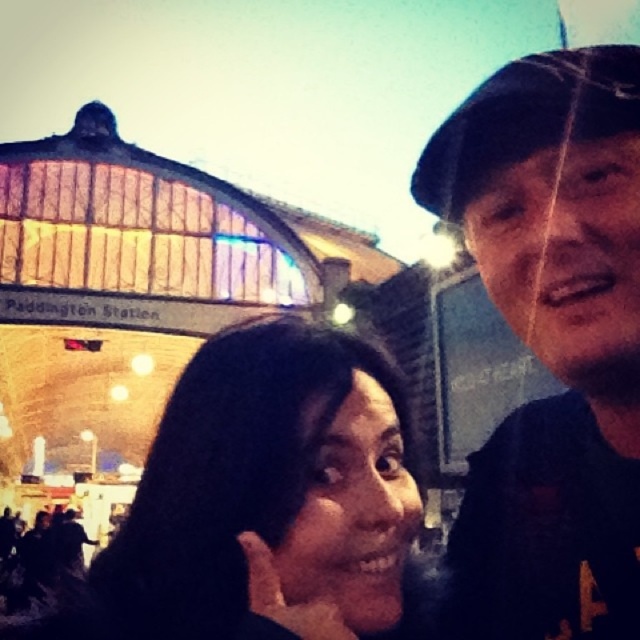
Based on the photo, you are observing two people at Paddington Station. You notice the black fabric cap at upper right and the black hair at center. Which of these two items is taller?

The black fabric cap at upper right is taller than the black hair at center.

You are a photographer standing at the entrance of Paddington Station. You want to take a photo of both the black fabric cap at upper right and the black hair at center in the same frame. Given that your camera has a maximum focus range of 10 meters, will you be able to capture both subjects clearly in one shot?

The distance between the black fabric cap at upper right and the black hair at center is 10.15 meters, which exceeds the camera maximum focus range of 10 meters. Therefore, you cannot capture both subjects clearly in one shot.

You are a photographer at Paddington Station and want to capture a photo of both the black fabric cap at upper right and the black hair at center in the same frame. Which object should you focus on first to ensure both are in the frame?

You should focus on the black hair at center first because the black fabric cap at upper right is narrower than the black hair at center, so centering on the wider object ensures both are included.